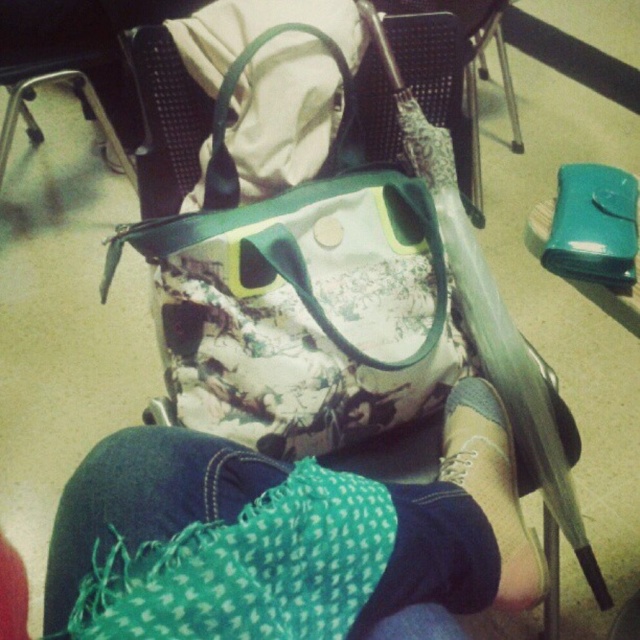
You are a photographer trying to capture a close detail shot of the green knitted scarf at lower center and the suede gray shoe at lower center. Since you want both items to be in focus, you need to know their vertical positions. Which one is positioned lower in the image?

The green knitted scarf at lower center is located below the suede gray shoe at lower center, so the green knitted scarf at lower center is positioned lower in the image.

You are taking a photo of the scene and want to focus on both the point at coordinates point (115, 560) and the point at coordinates point (509, 564). Which point should you focus on first to ensure both are in clear view?

Since point (115, 560) is closer to the camera than point (509, 564), you should focus on point (115, 560) first to ensure both points are in clear view.